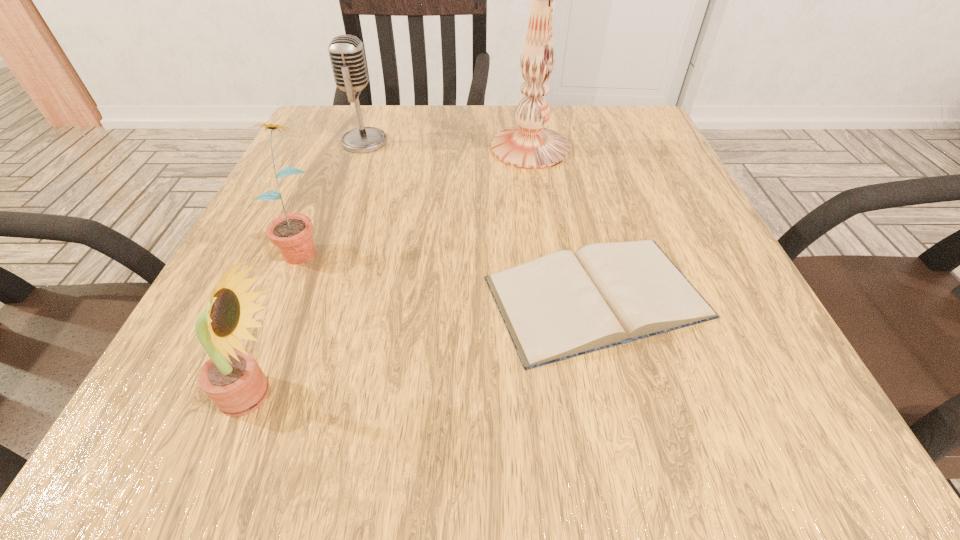
The width and height of the screenshot is (960, 540). In order to click on vacant space that satisfies the following two spatial constraints: 1. on the front side of the microphone; 2. on the face of the nearer sunflower in this screenshot , I will do `click(275, 394)`.